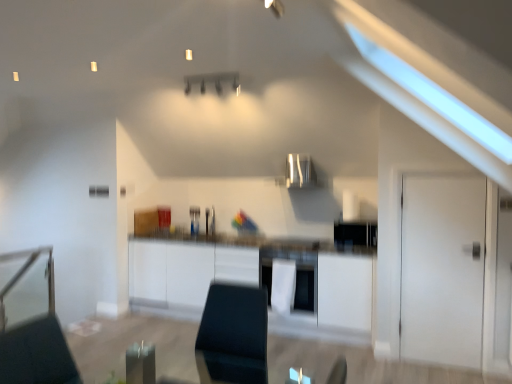
What do you see at coordinates (296, 275) in the screenshot? This screenshot has height=384, width=512. I see `white glossy oven at center` at bounding box center [296, 275].

In order to face white matte cabinet at center, should I rotate leftwards or rightwards?

To face it directly, rotate left by 0.685 degrees.

This screenshot has width=512, height=384. What do you see at coordinates (300, 171) in the screenshot?
I see `satin silver exhaust hood at center` at bounding box center [300, 171].

Measure the distance between white matte door at right and camera.

They are 3.32 meters apart.

Locate an element on the screen. The image size is (512, 384). white glossy oven at center is located at coordinates (296, 275).

From the picture: Can you confirm if satin silver exhaust hood at center is positioned to the left of white matte cabinet at center?

No, satin silver exhaust hood at center is not to the left of white matte cabinet at center.

Considering the positions of point (297, 158) and point (321, 253), is point (297, 158) closer or farther from the camera than point (321, 253)?

Clearly, point (297, 158) is more distant from the camera than point (321, 253).

Is satin silver exhaust hood at center far from white matte cabinet at center?

satin silver exhaust hood at center is positioned a significant distance from white matte cabinet at center.

Consider the image. Is satin silver exhaust hood at center turned away from white matte cabinet at center?

No, white matte cabinet at center is not at the back of satin silver exhaust hood at center.

Would you say white matte cabinet at center is to the left or to the right of satin silver exhaust hood at center in the picture?

In the image, white matte cabinet at center appears on the left side of satin silver exhaust hood at center.

Considering the sizes of objects white matte cabinet at center and satin silver exhaust hood at center in the image provided, who is shorter, white matte cabinet at center or satin silver exhaust hood at center?

satin silver exhaust hood at center is shorter.

Measure the distance between white matte cabinet at center and satin silver exhaust hood at center.

The distance of white matte cabinet at center from satin silver exhaust hood at center is 3.91 feet.

Between white matte cabinet at center and white matte door at right, which one has larger width?

white matte cabinet at center.

Which is in front, point (229, 269) or point (479, 326)?

Point (479, 326)

Considering the relative sizes of white glossy oven at center and satin silver exhaust hood at center in the image provided, is white glossy oven at center taller than satin silver exhaust hood at center?

Indeed, white glossy oven at center has a greater height compared to satin silver exhaust hood at center.

Could you tell me if white glossy oven at center is turned towards satin silver exhaust hood at center?

No, white glossy oven at center is not turned towards satin silver exhaust hood at center.

The image size is (512, 384). In order to click on oven in front of the satin silver exhaust hood at center in this screenshot , I will do `click(296, 275)`.

Is white matte door at right to the left or to the right of white glossy oven at center in the image?

From the image, it's evident that white matte door at right is to the right of white glossy oven at center.

This screenshot has width=512, height=384. What are the coordinates of `oven below the white matte door at right (from the image's perspective)` in the screenshot? It's located at (296, 275).

Does white matte door at right have a smaller size compared to white glossy oven at center?

Yes, white matte door at right is smaller than white glossy oven at center.

Considering the positions of objects satin silver exhaust hood at center and white matte door at right in the image provided, who is in front, satin silver exhaust hood at center or white matte door at right?

white matte door at right is in front.

Considering the relative sizes of satin silver exhaust hood at center and white matte door at right in the image provided, is satin silver exhaust hood at center smaller than white matte door at right?

No, satin silver exhaust hood at center is not smaller than white matte door at right.

Can you confirm if satin silver exhaust hood at center is thinner than white matte door at right?

No, satin silver exhaust hood at center is not thinner than white matte door at right.

Is white matte door at right spatially inside white matte cabinet at center, or outside of it?

white matte door at right is spatially situated outside white matte cabinet at center.

Measure the distance from white matte door at right to white matte cabinet at center.

The distance of white matte door at right from white matte cabinet at center is 3.45 feet.

From a real-world perspective, is white matte door at right below white matte cabinet at center?

Incorrect, from a real-world perspective, white matte door at right is higher than white matte cabinet at center.

You are a GUI agent. You are given a task and a screenshot of the screen. Output one action in this format:
    pyautogui.click(x=<x>, y=<y>)
    Task: Click on the cabinetry below the satin silver exhaust hood at center (from the image's perspective)
    The height and width of the screenshot is (384, 512).
    Given the screenshot: What is the action you would take?
    pyautogui.click(x=255, y=280)

You are a GUI agent. You are given a task and a screenshot of the screen. Output one action in this format:
    pyautogui.click(x=<x>, y=<y>)
    Task: Click on the exhaust hood that is above the white matte cabinet at center (from a real-world perspective)
    
    Given the screenshot: What is the action you would take?
    pyautogui.click(x=300, y=171)

Based on their spatial positions, is white matte door at right or white matte cabinet at center further from satin silver exhaust hood at center?

Based on the image, white matte door at right appears to be further to satin silver exhaust hood at center.

Based on their spatial positions, is white glossy oven at center or satin silver exhaust hood at center closer to white matte cabinet at center?

Based on the image, white glossy oven at center appears to be nearer to white matte cabinet at center.

Based on their spatial positions, is white matte door at right or satin silver exhaust hood at center further from white glossy oven at center?

white matte door at right lies further to white glossy oven at center than the other object.

Considering their positions, is white matte door at right positioned closer to satin silver exhaust hood at center than white glossy oven at center?

Among the two, white glossy oven at center is located nearer to satin silver exhaust hood at center.

Which object lies further to the anchor point white glossy oven at center, white matte cabinet at center or satin silver exhaust hood at center?

The object further to white glossy oven at center is satin silver exhaust hood at center.

Estimate the real-world distances between objects in this image. Which object is closer to white matte cabinet at center, white matte door at right or satin silver exhaust hood at center?

white matte door at right lies closer to white matte cabinet at center than the other object.

Estimate the real-world distances between objects in this image. Which object is further from satin silver exhaust hood at center, white matte cabinet at center or white glossy oven at center?

The object further to satin silver exhaust hood at center is white matte cabinet at center.

Estimate the real-world distances between objects in this image. Which object is further from white matte door at right, satin silver exhaust hood at center or white glossy oven at center?

satin silver exhaust hood at center lies further to white matte door at right than the other object.

Identify the location of exhaust hood between white matte cabinet at center and white matte door at right. Image resolution: width=512 pixels, height=384 pixels. (300, 171).

The image size is (512, 384). In order to click on exhaust hood between white glossy oven at center and white matte door at right in this screenshot , I will do `click(300, 171)`.

This screenshot has height=384, width=512. Find the location of `oven between satin silver exhaust hood at center and white matte cabinet at center in the up-down direction`. oven between satin silver exhaust hood at center and white matte cabinet at center in the up-down direction is located at coordinates 296,275.

The image size is (512, 384). I want to click on oven between white matte cabinet at center and white matte door at right, so click(296, 275).